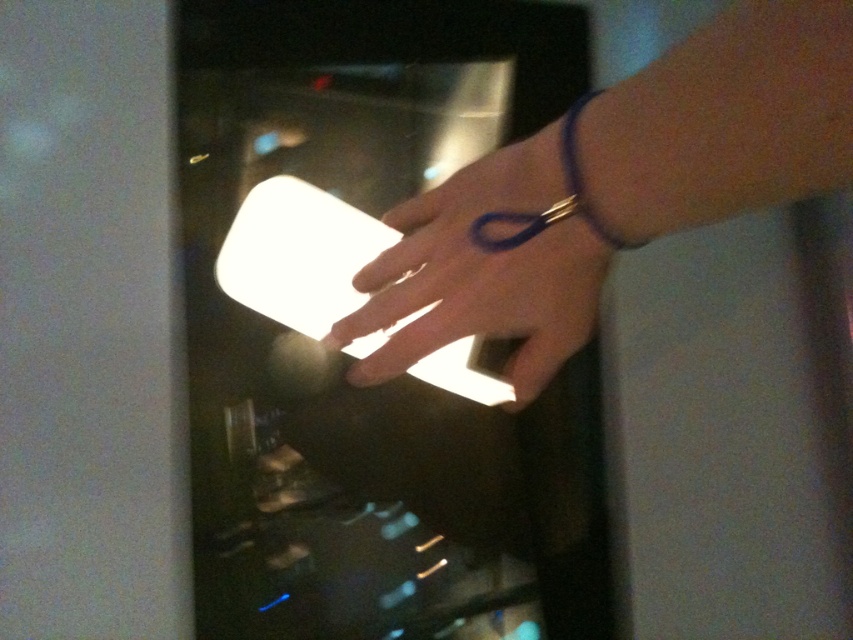
Is smooth skin hand at center to the left of purple rubber band at upper right from the viewer's perspective?

Indeed, smooth skin hand at center is positioned on the left side of purple rubber band at upper right.

Does smooth skin hand at center have a greater height compared to purple rubber band at upper right?

Indeed, smooth skin hand at center has a greater height compared to purple rubber band at upper right.

The height and width of the screenshot is (640, 853). Find the location of `smooth skin hand at center`. smooth skin hand at center is located at coordinates (614, 188).

Who is taller, white matte ring at center or purple rubber band at upper right?

white matte ring at center

The height and width of the screenshot is (640, 853). Describe the element at coordinates (482, 273) in the screenshot. I see `white matte ring at center` at that location.

What are the coordinates of `white matte ring at center` in the screenshot? It's located at (482, 273).

At what (x,y) coordinates should I click in order to perform the action: click on smooth skin hand at center. Please return your answer as a coordinate pair (x, y). The image size is (853, 640). Looking at the image, I should click on (614, 188).

Who is higher up, smooth skin hand at center or white matte ring at center?

smooth skin hand at center is above.

In order to click on smooth skin hand at center in this screenshot , I will do `click(614, 188)`.